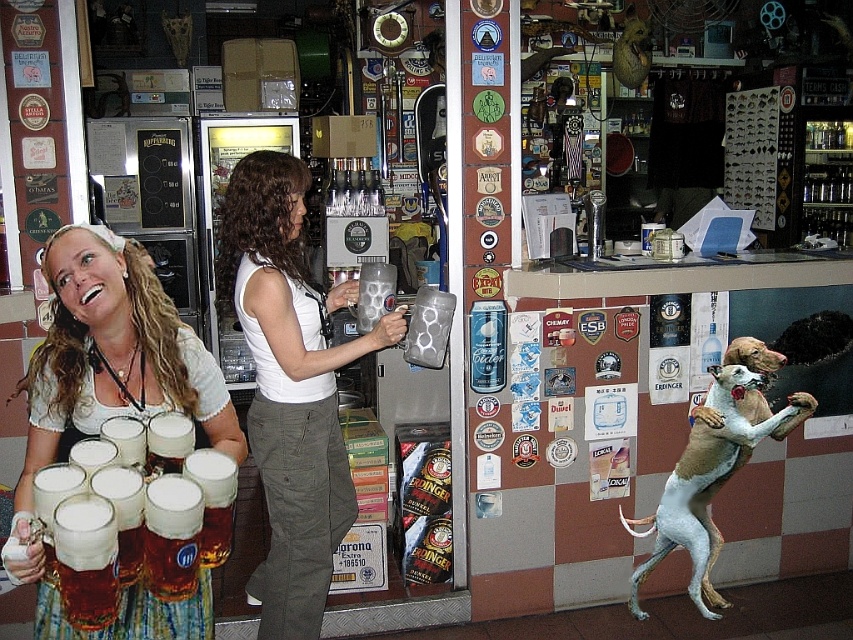
In the scene shown: You are standing in the bar and want to reach the white cotton tank top at center to hand it to someone. Considering the distance, can you comfortably stretch and grab it without moving your feet?

The white cotton tank top at center is 7.34 feet away from the viewer. Since the average human arm span is about 3 feet, you cannot comfortably reach it without moving closer.

You are a photographer taking a picture of the two women in the bar. You notice the white cotton tank top at center and the matte white blouse at center. Which clothing item is positioned lower on the person wearing it?

The white cotton tank top at center is positioned lower because it is below the matte white blouse at center.

You are a photographer trying to capture a closeup of the matte white blouse at center without the light brown fur at lower right appearing in the frame. Is this possible given their positions?

The matte white blouse at center is positioned over the light brown fur at lower right, so it is possible to capture a closeup of the matte white blouse at center without the light brown fur at lower right appearing in the frame by focusing on the upper area where the blouse is located.